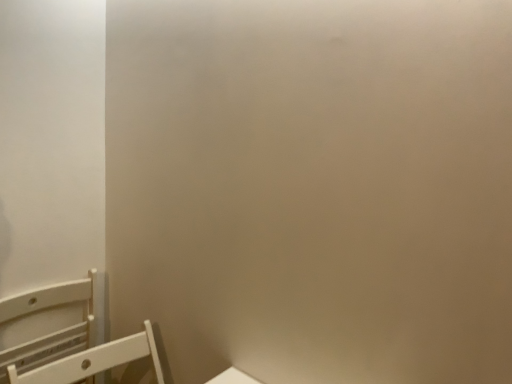
Question: Considering the positions of white matte chair at lower left, marked as the second furniture in a left-to-right arrangement, and white plastic chair at lower left, the second furniture viewed from the right, in the image, is white matte chair at lower left, marked as the second furniture in a left-to-right arrangement, wider or thinner than white plastic chair at lower left, the second furniture viewed from the right,?

Choices:
 (A) wide
 (B) thin

Answer: (A)

Question: From a real-world perspective, is white matte chair at lower left, marked as the second furniture in a left-to-right arrangement, positioned above or below white plastic chair at lower left, the 1th furniture in the left-to-right sequence?

Choices:
 (A) above
 (B) below

Answer: (A)

Question: Considering the positions of white matte chair at lower left, the 1th furniture in the right-to-left sequence, and white plastic chair at lower left, the second furniture viewed from the right, in the image, is white matte chair at lower left, the 1th furniture in the right-to-left sequence, bigger or smaller than white plastic chair at lower left, the second furniture viewed from the right,?

Choices:
 (A) big
 (B) small

Answer: (A)

Question: Does point (90, 337) appear closer or farther from the camera than point (11, 370)?

Choices:
 (A) farther
 (B) closer

Answer: (A)

Question: In the image, is white plastic chair at lower left, the second furniture viewed from the right, on the left side or the right side of white matte chair at lower left, marked as the second furniture in a left-to-right arrangement?

Choices:
 (A) left
 (B) right

Answer: (A)

Question: From a real-world perspective, is white plastic chair at lower left, the second furniture viewed from the right, physically located above or below white matte chair at lower left, marked as the second furniture in a left-to-right arrangement?

Choices:
 (A) above
 (B) below

Answer: (B)

Question: Is white plastic chair at lower left, the 1th furniture in the left-to-right sequence, bigger or smaller than white matte chair at lower left, marked as the second furniture in a left-to-right arrangement?

Choices:
 (A) big
 (B) small

Answer: (B)